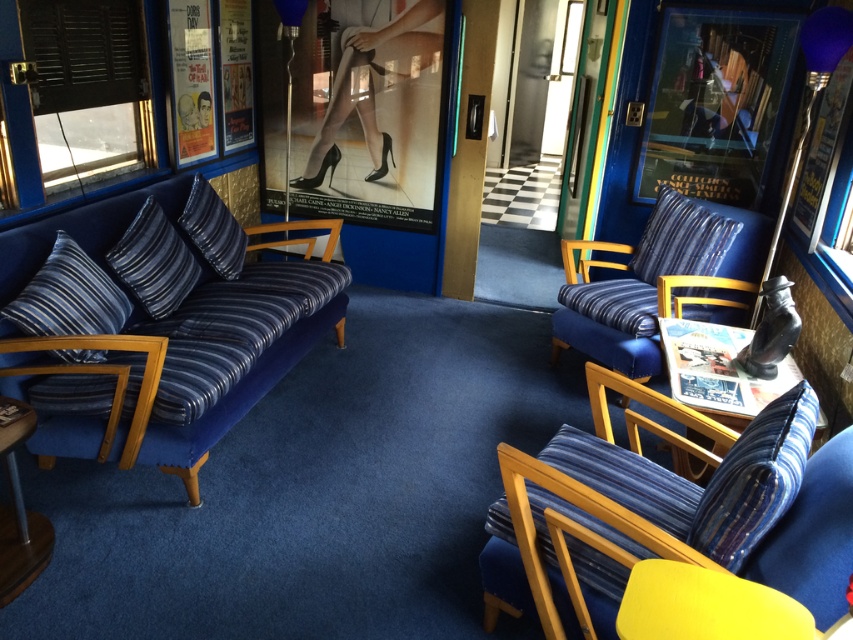
Who is lower down, velvet blue armchair at right or blue striped pillow at upper right?

velvet blue armchair at right is lower down.

From the picture: Does velvet blue armchair at right have a greater width compared to blue striped pillow at upper right?

Yes, velvet blue armchair at right is wider than blue striped pillow at upper right.

Find the location of `velvet blue armchair at right`. velvet blue armchair at right is located at coordinates (654, 280).

The height and width of the screenshot is (640, 853). I want to click on velvet blue armchair at right, so click(x=654, y=280).

I want to click on velvet blue couch at left, so click(x=190, y=330).

Which is more to the right, velvet blue couch at left or wooden table at lower left?

velvet blue couch at left is more to the right.

Is point (252, 358) positioned after point (13, 572)?

Yes.

Identify the location of velvet blue couch at left. (190, 330).

Between velvet blue couch at left and blue striped pillow at upper right, which one has more height?

Standing taller between the two is velvet blue couch at left.

Is point (140, 189) positioned before point (682, 268)?

Yes, it is.

Is point (276, 284) positioned behind point (706, 224)?

Yes, it is.

Locate an element on the screen. This screenshot has width=853, height=640. velvet blue couch at left is located at coordinates (190, 330).